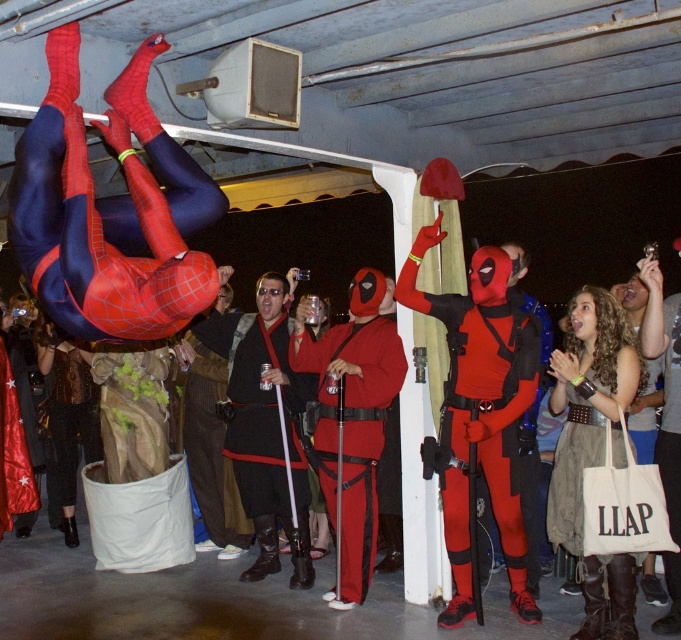
Question: Among these points, which one is farthest from the camera?

Choices:
 (A) (99, 440)
 (B) (78, 118)
 (C) (496, 408)
 (D) (0, 436)

Answer: (A)

Question: Which point is closer to the camera?

Choices:
 (A) distressed canvas tote bag at lower right
 (B) velvet black dress at lower left

Answer: (A)

Question: Is distressed canvas tote bag at lower right above brown corduroy pants at center?

Choices:
 (A) no
 (B) yes

Answer: (B)

Question: Can you confirm if shiny spandex suit at upper left is positioned to the left of distressed canvas tote bag at lower right?

Choices:
 (A) yes
 (B) no

Answer: (A)

Question: Which is nearer to the matte red and black costume at center?

Choices:
 (A) velvet black dress at lower left
 (B) shiny red cape at lower left
 (C) distressed canvas tote bag at lower right

Answer: (C)

Question: Can you confirm if brown corduroy pants at center is positioned above velvet black dress at lower left?

Choices:
 (A) no
 (B) yes

Answer: (A)